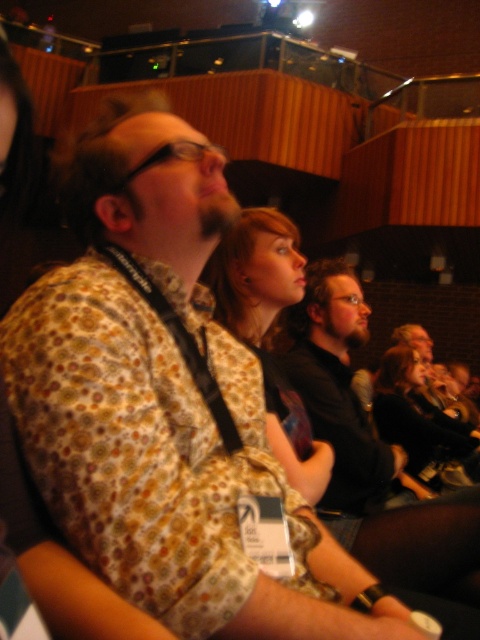
In the scene shown: Does floral-patterned shirt at center have a greater height compared to matte black jacket at center?

Correct, floral-patterned shirt at center is much taller as matte black jacket at center.

Which is more to the right, floral-patterned shirt at center or matte black jacket at center?

matte black jacket at center is more to the right.

Is point (313, 460) positioned behind point (463, 452)?

No.

The height and width of the screenshot is (640, 480). I want to click on floral-patterned shirt at center, so click(268, 330).

Which is below, dark brown leather jacket at center or floral-patterned shirt at center?

dark brown leather jacket at center is below.

Between dark brown leather jacket at center and floral-patterned shirt at center, which one has more height?

dark brown leather jacket at center

Between point (471, 552) and point (217, 275), which one is positioned behind?

Positioned behind is point (217, 275).

At what (x,y) coordinates should I click in order to perform the action: click on dark brown leather jacket at center. Please return your answer as a coordinate pair (x, y). This screenshot has height=640, width=480. Looking at the image, I should click on (337, 387).

Who is taller, dark brown leather jacket at center or matte black jacket at center?

dark brown leather jacket at center is taller.

Does dark brown leather jacket at center appear on the right side of matte black jacket at center?

Incorrect, dark brown leather jacket at center is not on the right side of matte black jacket at center.

Describe the element at coordinates (337, 387) in the screenshot. The image size is (480, 640). I see `dark brown leather jacket at center` at that location.

Identify the location of dark brown leather jacket at center. (337, 387).